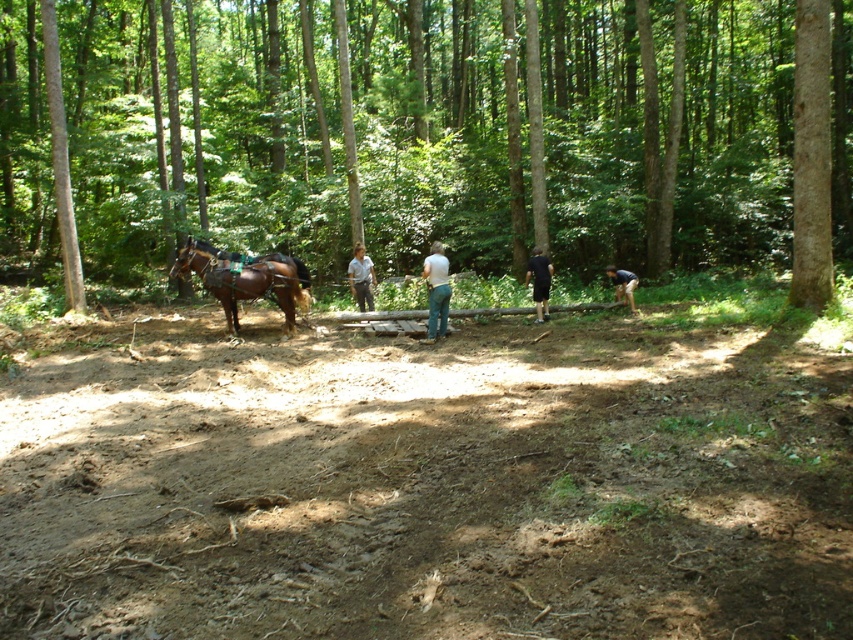
Question: Which point is farther from the camera taking this photo?

Choices:
 (A) (634, 285)
 (B) (432, 305)

Answer: (A)

Question: Among these objects, which one is nearest to the camera?

Choices:
 (A) brown glossy horse at center
 (B) white cotton shirt at center
 (C) brown rough tree at right
 (D) black cotton shirt at center

Answer: (C)

Question: Where is brown dirt track at center located in relation to black cotton shirt at center in the image?

Choices:
 (A) right
 (B) left

Answer: (B)

Question: Among these objects, which one is farthest from the camera?

Choices:
 (A) brown wood tree at left
 (B) white cotton shirt at center
 (C) black cotton shirt at center
 (D) light brown leather jacket at center

Answer: (D)

Question: Does brown wood tree at left have a larger size compared to brown rough tree at right?

Choices:
 (A) yes
 (B) no

Answer: (A)

Question: Can you confirm if brown dirt track at center is thinner than light blue jeans at center?

Choices:
 (A) yes
 (B) no

Answer: (B)